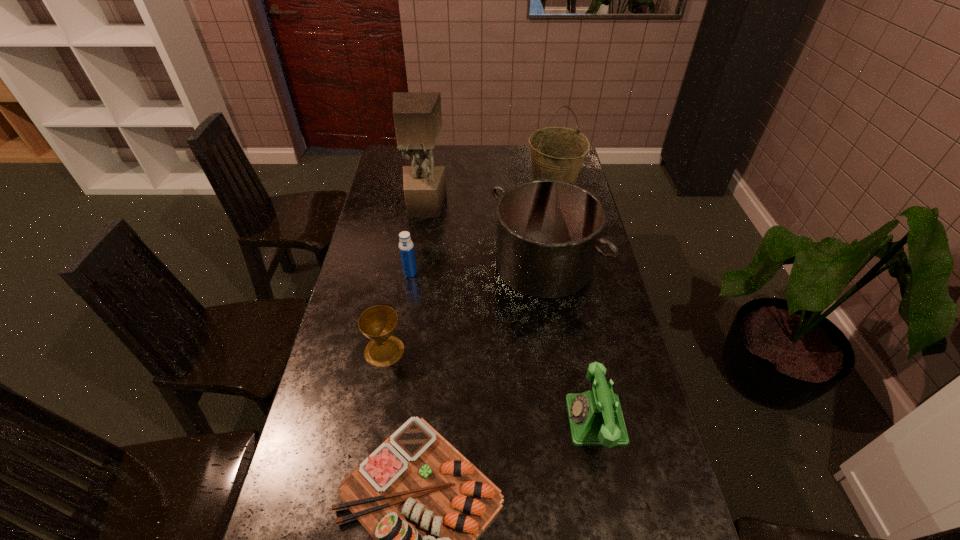
Find the location of `free space located 0.380m on the right of the chalice`. free space located 0.380m on the right of the chalice is located at coordinates (534, 350).

This screenshot has width=960, height=540. I want to click on free location located 0.100m on the dial of the telephone, so click(x=529, y=420).

Where is `vacant space located on the dial of the telephone`? Image resolution: width=960 pixels, height=540 pixels. vacant space located on the dial of the telephone is located at coordinates (537, 420).

Locate an element on the screen. The height and width of the screenshot is (540, 960). free space located on the dial of the telephone is located at coordinates (521, 420).

Locate an element on the screen. This screenshot has height=540, width=960. object situated at the far edge is located at coordinates (557, 153).

At what (x,y) coordinates should I click in order to perform the action: click on sculpture located at the left edge. Please return your answer as a coordinate pair (x, y). This screenshot has height=540, width=960. Looking at the image, I should click on (417, 116).

The width and height of the screenshot is (960, 540). In order to click on chalice present at the left edge in this screenshot , I will do `click(378, 323)`.

This screenshot has height=540, width=960. In order to click on wine bucket that is positioned at the right edge in this screenshot , I will do `click(557, 153)`.

I want to click on pan that is positioned at the right edge, so click(x=548, y=231).

Image resolution: width=960 pixels, height=540 pixels. What are the coordinates of `telephone positioned at the right edge` in the screenshot? It's located at 595,416.